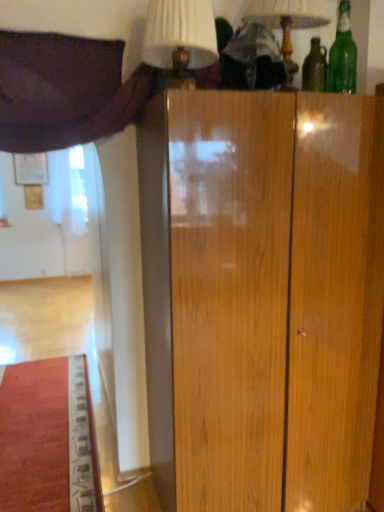
Question: Does purple fabric curtain at upper left turn towards white fabric lampshade at upper center, the second table lamp positioned from the right?

Choices:
 (A) no
 (B) yes

Answer: (B)

Question: Is purple fabric curtain at upper left bigger than white fabric lampshade at upper center, the second table lamp positioned from the right?

Choices:
 (A) yes
 (B) no

Answer: (A)

Question: Can we say purple fabric curtain at upper left lies outside white fabric lampshade at upper center, which ranks as the 1th table lamp in left-to-right order?

Choices:
 (A) no
 (B) yes

Answer: (B)

Question: Is purple fabric curtain at upper left smaller than white fabric lampshade at upper center, which ranks as the 1th table lamp in left-to-right order?

Choices:
 (A) yes
 (B) no

Answer: (B)

Question: Are purple fabric curtain at upper left and white fabric lampshade at upper center, which ranks as the 1th table lamp in left-to-right order, located far from each other?

Choices:
 (A) no
 (B) yes

Answer: (A)

Question: Is point (56, 125) closer or farther from the camera than point (269, 7)?

Choices:
 (A) farther
 (B) closer

Answer: (B)

Question: In terms of size, does purple fabric curtain at upper left appear bigger or smaller than matte white lampshade at upper center, which appears as the second table lamp when viewed from the left?

Choices:
 (A) big
 (B) small

Answer: (A)

Question: Considering the positions of purple fabric curtain at upper left and matte white lampshade at upper center, which appears as the second table lamp when viewed from the left, in the image, is purple fabric curtain at upper left wider or thinner than matte white lampshade at upper center, which appears as the second table lamp when viewed from the left,?

Choices:
 (A) wide
 (B) thin

Answer: (A)

Question: From their relative heights in the image, would you say purple fabric curtain at upper left is taller or shorter than matte white lampshade at upper center, which appears as the second table lamp when viewed from the left?

Choices:
 (A) tall
 (B) short

Answer: (A)

Question: Considering the relative positions of green glass bottle at upper right and matte white lampshade at upper center, arranged as the first table lamp when viewed from the right, in the image provided, is green glass bottle at upper right to the left or to the right of matte white lampshade at upper center, arranged as the first table lamp when viewed from the right,?

Choices:
 (A) left
 (B) right

Answer: (B)

Question: Considering the positions of green glass bottle at upper right and matte white lampshade at upper center, arranged as the first table lamp when viewed from the right, in the image, is green glass bottle at upper right taller or shorter than matte white lampshade at upper center, arranged as the first table lamp when viewed from the right,?

Choices:
 (A) tall
 (B) short

Answer: (B)

Question: Relative to matte white lampshade at upper center, which appears as the second table lamp when viewed from the left, is green glass bottle at upper right in front or behind?

Choices:
 (A) behind
 (B) front

Answer: (A)

Question: From a real-world perspective, relative to matte white lampshade at upper center, arranged as the first table lamp when viewed from the right, is green glass bottle at upper right vertically above or below?

Choices:
 (A) above
 (B) below

Answer: (B)

Question: In terms of height, does green glass bottle at upper right look taller or shorter compared to white fabric lampshade at upper center, the second table lamp positioned from the right?

Choices:
 (A) tall
 (B) short

Answer: (A)

Question: Looking at the image, does green glass bottle at upper right seem bigger or smaller compared to white fabric lampshade at upper center, which ranks as the 1th table lamp in left-to-right order?

Choices:
 (A) small
 (B) big

Answer: (A)